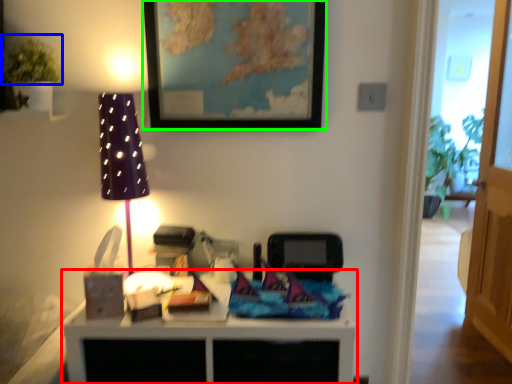
Question: Which object is positioned closest to table (highlighted by a red box)? Select from plant (highlighted by a blue box) and picture frame (highlighted by a green box).

Choices:
 (A) plant
 (B) picture frame

Answer: (B)